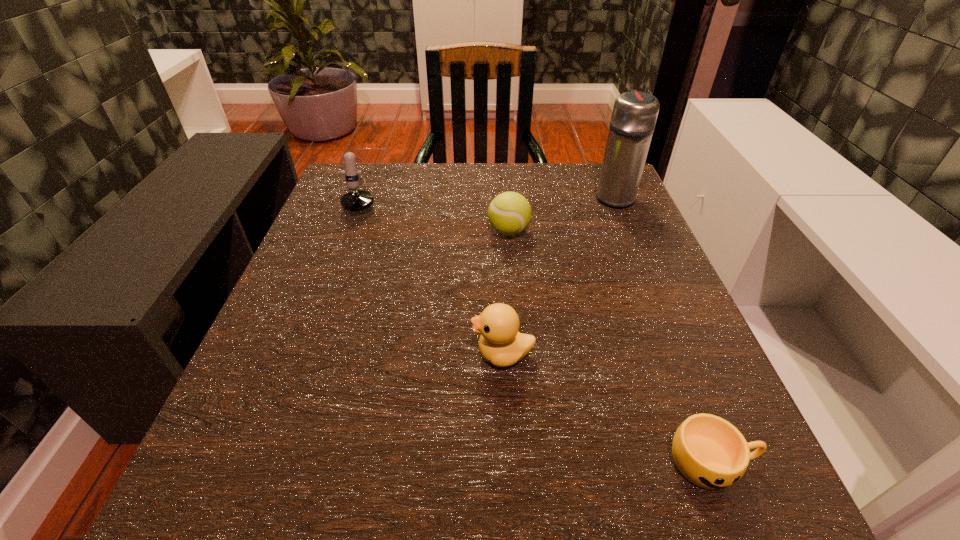
Find the location of a particular element. object at the far left corner is located at coordinates (357, 200).

You are a GUI agent. You are given a task and a screenshot of the screen. Output one action in this format:
    pyautogui.click(x=<x>, y=<y>)
    Task: Click on the object present at the far right corner
    This screenshot has width=960, height=540.
    Given the screenshot: What is the action you would take?
    pyautogui.click(x=634, y=115)

Where is `object that is at the near right corner`? The image size is (960, 540). object that is at the near right corner is located at coordinates (710, 452).

In the image, there is a desktop. Where is `vacant space at the far edge`? This screenshot has height=540, width=960. vacant space at the far edge is located at coordinates (433, 163).

You are a GUI agent. You are given a task and a screenshot of the screen. Output one action in this format:
    pyautogui.click(x=<x>, y=<y>)
    Task: Click on the vacant space at the near edge of the desktop
    
    Given the screenshot: What is the action you would take?
    pyautogui.click(x=384, y=515)

The image size is (960, 540). In order to click on free space at the left edge of the desktop in this screenshot , I will do `click(349, 228)`.

Where is `vacant space at the right edge`? The height and width of the screenshot is (540, 960). vacant space at the right edge is located at coordinates (601, 293).

You are a GUI agent. You are given a task and a screenshot of the screen. Output one action in this format:
    pyautogui.click(x=<x>, y=<y>)
    Task: Click on the vacant space at the far left corner of the desktop
    This screenshot has width=960, height=540.
    Given the screenshot: What is the action you would take?
    pyautogui.click(x=398, y=178)

Where is `vacant region at the far right corner`? vacant region at the far right corner is located at coordinates tap(572, 200).

Where is `blank region between the microphone and the tallest object`? The image size is (960, 540). blank region between the microphone and the tallest object is located at coordinates (489, 196).